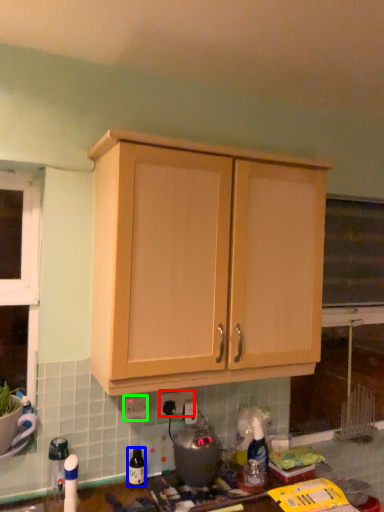
Question: Which is farther away from electric outlet (highlighted by a red box)? bottle (highlighted by a blue box) or electric outlet (highlighted by a green box)?

Choices:
 (A) bottle
 (B) electric outlet

Answer: (A)